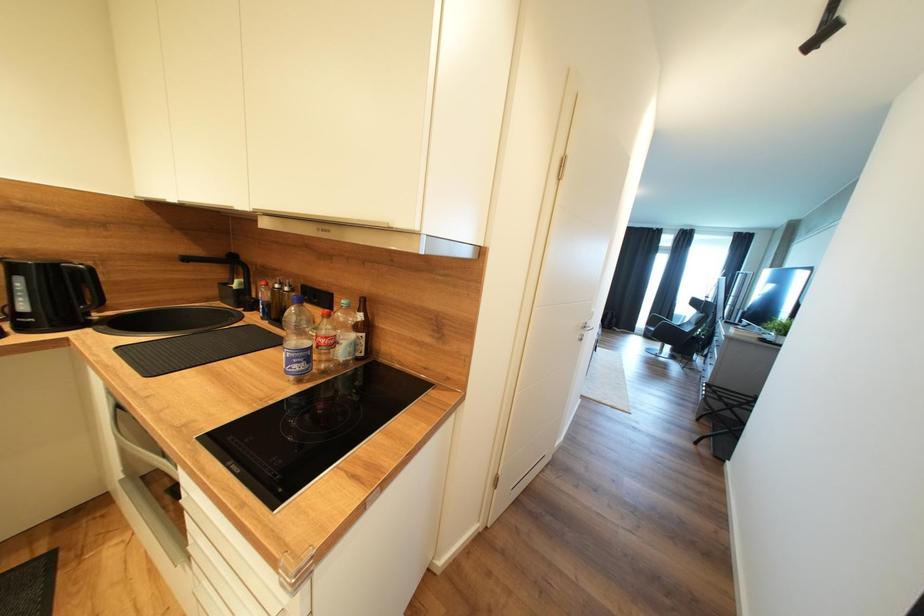
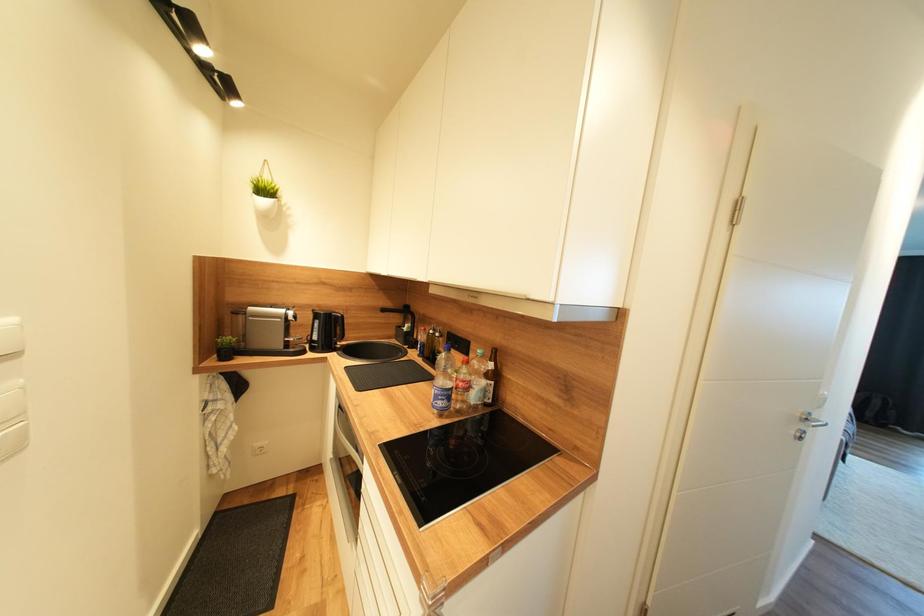
Question: Based on the continuous images, in which direction is the camera rotating? Reply with the corresponding letter.

Choices:
 (A) Left
 (B) Right
 (C) Up
 (D) Down

Answer: (A)